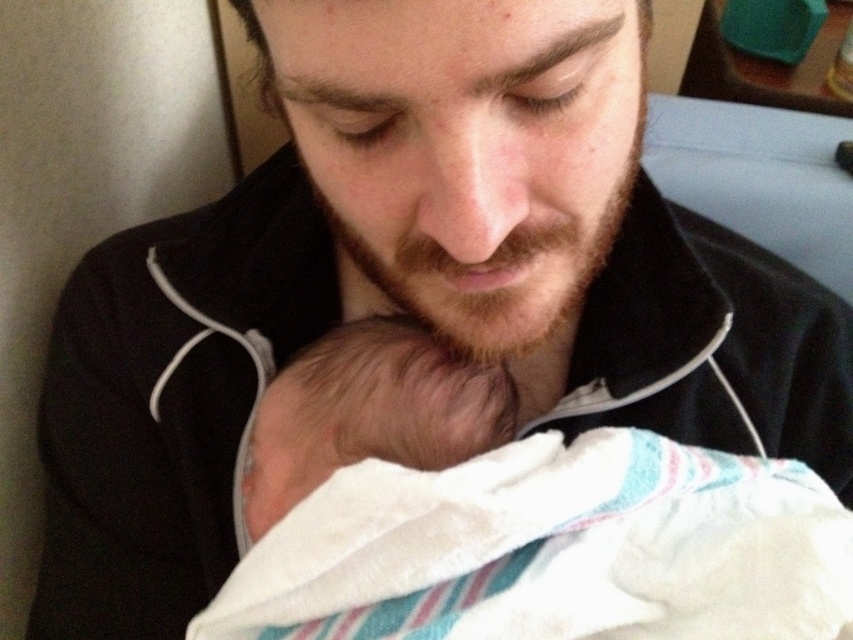
You are a photographer taking a close up photo of the man and the baby. You need to ensure that both the soft white blanket at lower center and the soft beige skin at center are clearly visible. Since the blanket is larger, which object should you focus on to make sure both are in focus?

The soft white blanket at lower center is larger than the soft beige skin at center. To ensure both are in focus, focus on the soft beige skin at center since it is closer to the camera and the larger size of the blanket will still be within the depth of field.

From the picture: You are a nurse checking the baby for proper swaddling. The hospital guidelines state that the blanket should be snug against the baby to prevent accidental loosening. Based on the image, is the soft white blanket at lower center close enough to the soft beige skin at center to meet the guidelines?

The soft white blanket at lower center is 2.06 inches away from the soft beige skin at center. Since the hospital guidelines require the blanket to be snug, this distance may not meet the requirement as 2.06 inches is likely too far for proper swaddling.